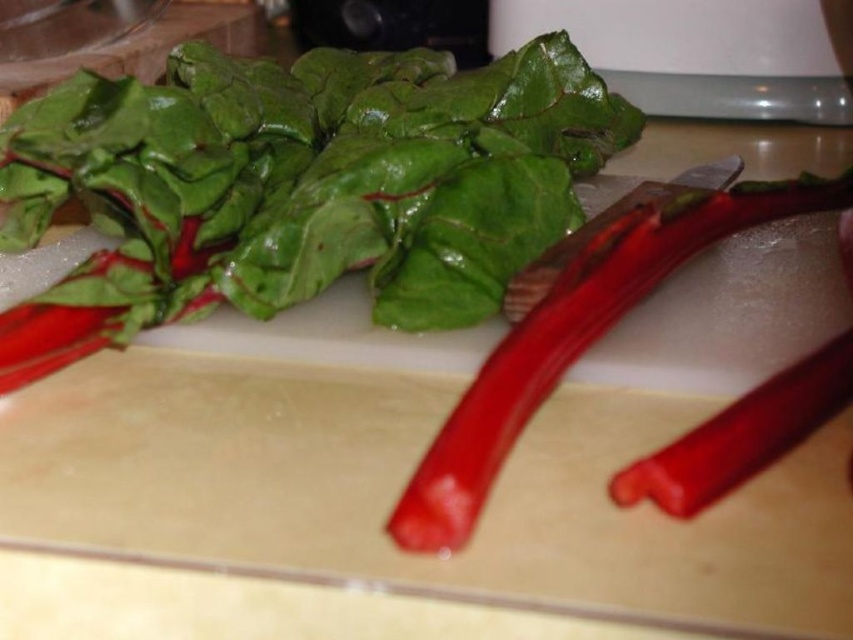
You are holding a knife that is 8 inches long. You want to cut the chard stems on the cutting board. If you place the tip of your knife at point (x=479, y=388), can the blade reach the edge of the cutting board without extending beyond it?

The distance from point (x=479, y=388) to the viewer is 11.27 inches. Since the knife is 8 inches long, the blade can reach up to 8 inches from the tip. Therefore, the blade will not extend beyond the cutting board because 8 inches is less than 11.27 inches.

You are preparing a salad and need to cut the chard stems. The beige plastic cutting board at center is where you will place the stems. The metallic red knife at center is your cutting tool. To ensure you can reach both the knife and the cutting board comfortably, what is the minimum distance your workspace should be from the edge of the counter?

The beige plastic cutting board at center is 14.75 centimeters away from the metallic red knife at center. Therefore, your workspace should be at least 14.75 centimeters from the edge of the counter to comfortably reach both items.